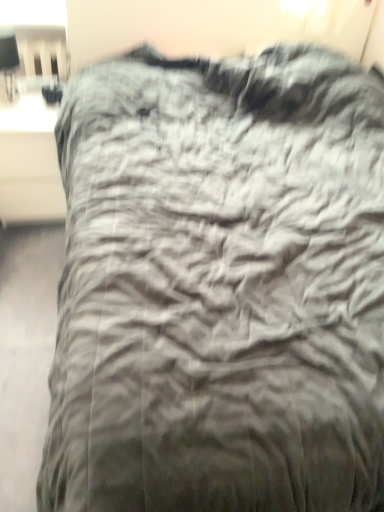
Question: Would you say matte white table at left is to the left or to the right of matte black lampshade at upper left in the picture?

Choices:
 (A) right
 (B) left

Answer: (A)

Question: Is matte white table at left wider or thinner than matte black lampshade at upper left?

Choices:
 (A) wide
 (B) thin

Answer: (A)

Question: From the image's perspective, is matte white table at left located above or below matte black lampshade at upper left?

Choices:
 (A) below
 (B) above

Answer: (A)

Question: Is matte black lampshade at upper left bigger or smaller than matte white table at left?

Choices:
 (A) big
 (B) small

Answer: (B)

Question: In terms of height, does matte black lampshade at upper left look taller or shorter compared to matte white table at left?

Choices:
 (A) tall
 (B) short

Answer: (B)

Question: Choose the correct answer: Is matte black lampshade at upper left inside matte white table at left or outside it?

Choices:
 (A) outside
 (B) inside

Answer: (A)

Question: From the image's perspective, relative to matte white table at left, is matte black lampshade at upper left above or below?

Choices:
 (A) above
 (B) below

Answer: (A)